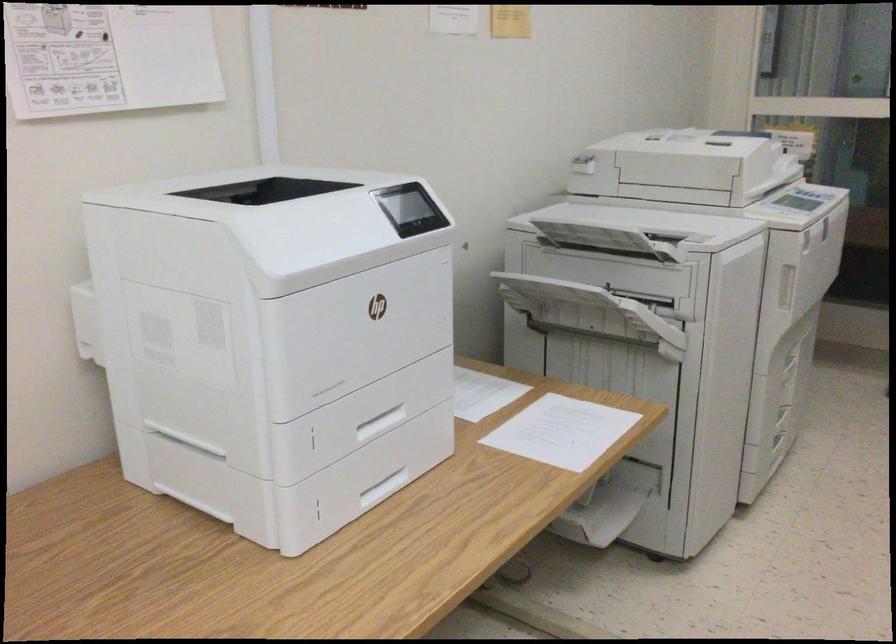
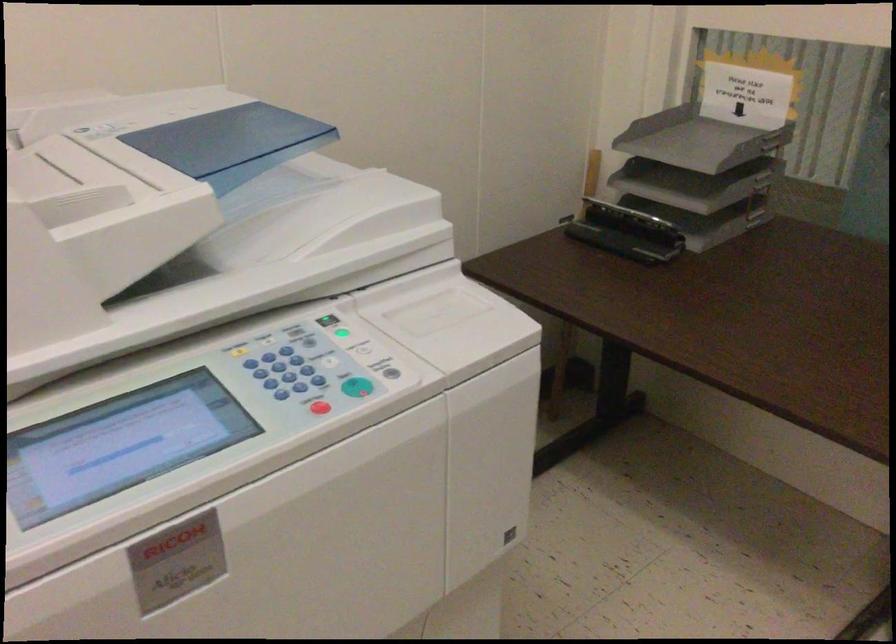
The images are taken continuously from a first-person perspective. In which direction are you moving?

The cameraman moved toward right, forward.